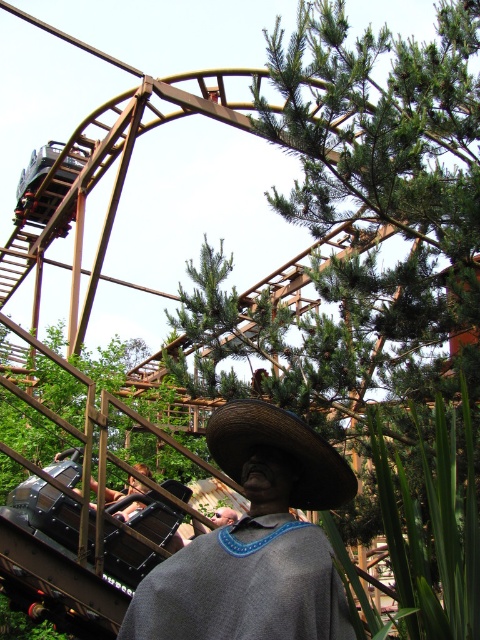
Question: Which object appears closest to the camera in this image?

Choices:
 (A) woven straw hat at center
 (B) woven straw cowboy hat at center

Answer: (A)

Question: Which object is closer to the camera taking this photo?

Choices:
 (A) woven straw hat at center
 (B) metallic silver helmet at lower center

Answer: (A)

Question: Which object appears closest to the camera in this image?

Choices:
 (A) metallic silver helmet at lower center
 (B) woven straw hat at center

Answer: (B)

Question: Can you confirm if woven straw hat at center is wider than metallic silver helmet at lower center?

Choices:
 (A) no
 (B) yes

Answer: (B)

Question: Is woven straw cowboy hat at center thinner than metallic silver helmet at lower center?

Choices:
 (A) no
 (B) yes

Answer: (B)

Question: Is woven straw cowboy hat at center above metallic silver helmet at lower center?

Choices:
 (A) no
 (B) yes

Answer: (B)